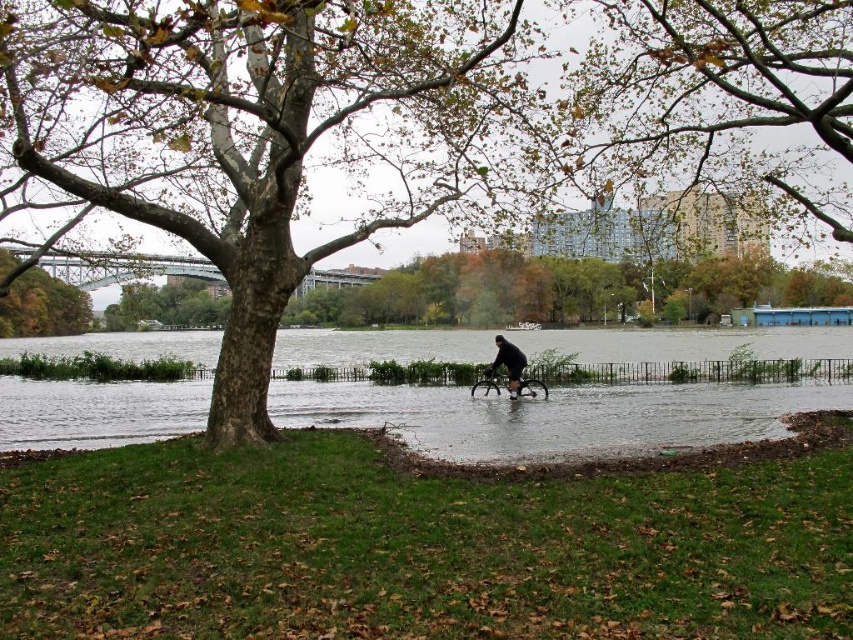
You are a delivery rider who needs to navigate through the flooded area shown in the image. You see the brown matte tree at upper left and the dark matte bicycle at center. Which object is bigger in size?

The brown matte tree at upper left is larger in size compared to the dark matte bicycle at center according to the description.